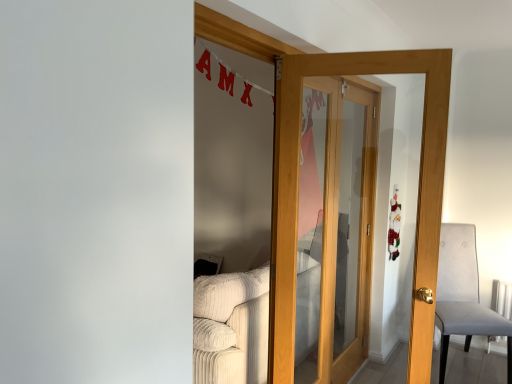
Question: In terms of width, does gray fabric chair at right look wider or thinner when compared to beige corduroy couch at lower left?

Choices:
 (A) thin
 (B) wide

Answer: (A)

Question: Which is correct: gray fabric chair at right is inside beige corduroy couch at lower left, or outside of it?

Choices:
 (A) inside
 (B) outside

Answer: (B)

Question: Which of these objects is positioned farthest from the beige corduroy couch at lower left?

Choices:
 (A) gray fabric chair at right
 (B) light brown wooden door at center

Answer: (A)

Question: Estimate the real-world distances between objects in this image. Which object is farther from the light brown wooden door at center?

Choices:
 (A) gray fabric chair at right
 (B) beige corduroy couch at lower left

Answer: (A)